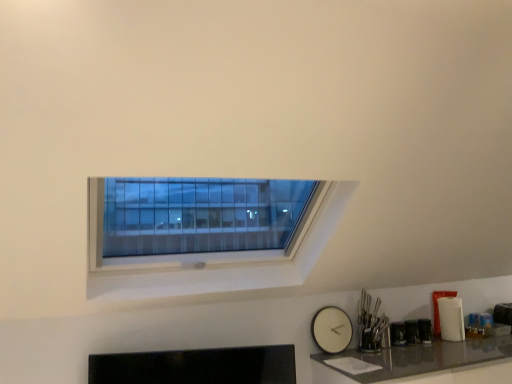
Where is `free space in front of white matte clock at lower right`? This screenshot has width=512, height=384. free space in front of white matte clock at lower right is located at coordinates (336, 360).